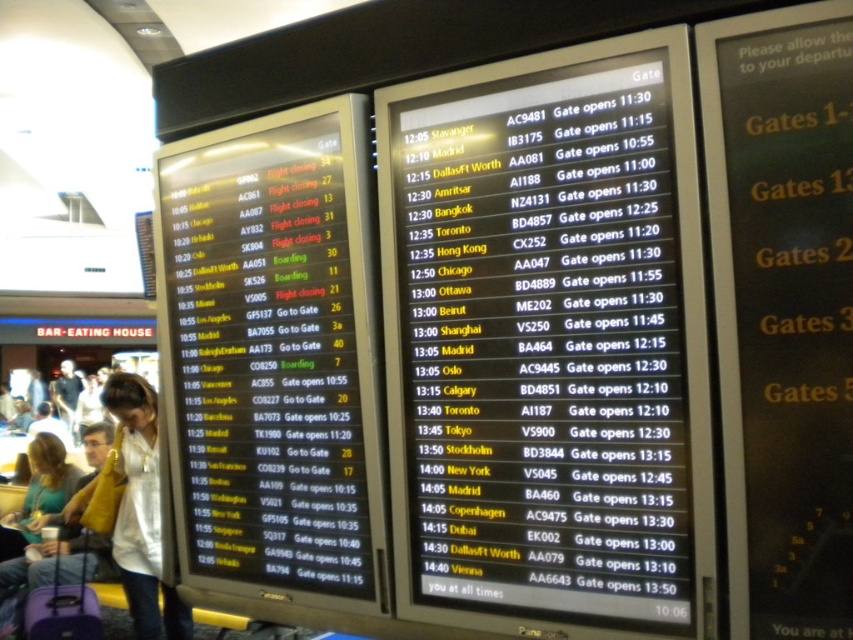
Does black glossy signboard at upper center have a larger size compared to light beige shirt at lower left?

Incorrect, black glossy signboard at upper center is not larger than light beige shirt at lower left.

Which is above, black glossy signboard at upper center or light beige shirt at lower left?

black glossy signboard at upper center

Is point (793, 346) positioned behind point (138, 397)?

No, (793, 346) is closer to viewer.

Locate an element on the screen. The image size is (853, 640). black glossy signboard at upper center is located at coordinates (782, 310).

Between point (509, 230) and point (326, 116), which one is positioned behind?

The point (326, 116) is behind.

Can you confirm if black plastic flight information board at center is thinner than black glossy screen at left?

Indeed, black plastic flight information board at center has a lesser width compared to black glossy screen at left.

Does point (618, 451) lie behind point (282, 224)?

That is False.

Where is `black plastic flight information board at center`? black plastic flight information board at center is located at coordinates (543, 346).

Could you measure the distance between black plastic flight information board at center and matte purple suitcase at lower left?

black plastic flight information board at center is 3.24 meters away from matte purple suitcase at lower left.

Between black plastic flight information board at center and matte purple suitcase at lower left, which one appears on the right side from the viewer's perspective?

black plastic flight information board at center is more to the right.

This screenshot has height=640, width=853. In order to click on black plastic flight information board at center in this screenshot , I will do `click(543, 346)`.

You are a GUI agent. You are given a task and a screenshot of the screen. Output one action in this format:
    pyautogui.click(x=<x>, y=<y>)
    Task: Click on the black plastic flight information board at center
    
    Given the screenshot: What is the action you would take?
    pyautogui.click(x=543, y=346)